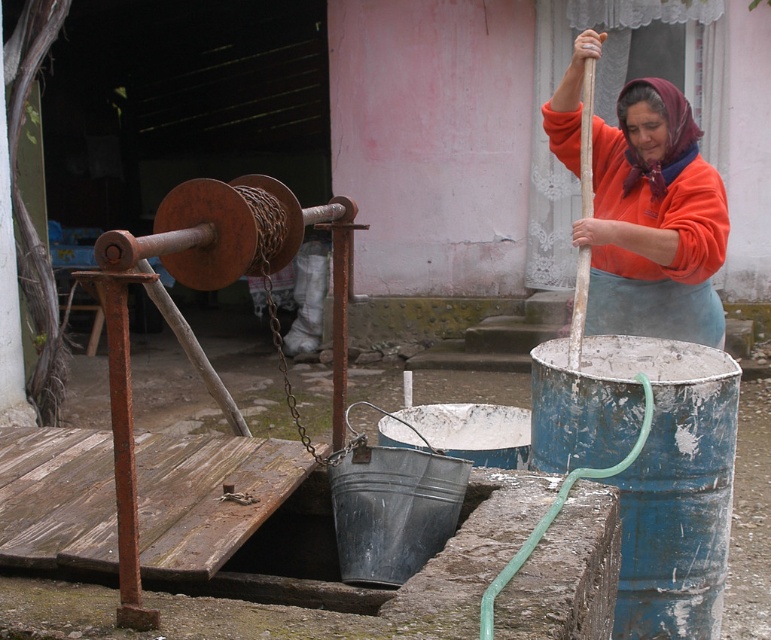
Question: Does blue metallic barrel at lower right have a lesser width compared to orange fleece at center?

Choices:
 (A) no
 (B) yes

Answer: (B)

Question: Among these objects, which one is farthest from the camera?

Choices:
 (A) blue metallic barrel at lower right
 (B) orange fleece at center

Answer: (B)

Question: Does blue metallic barrel at lower right appear over orange fleece at center?

Choices:
 (A) yes
 (B) no

Answer: (B)

Question: Does blue metallic barrel at lower right lie in front of orange fleece at center?

Choices:
 (A) no
 (B) yes

Answer: (B)